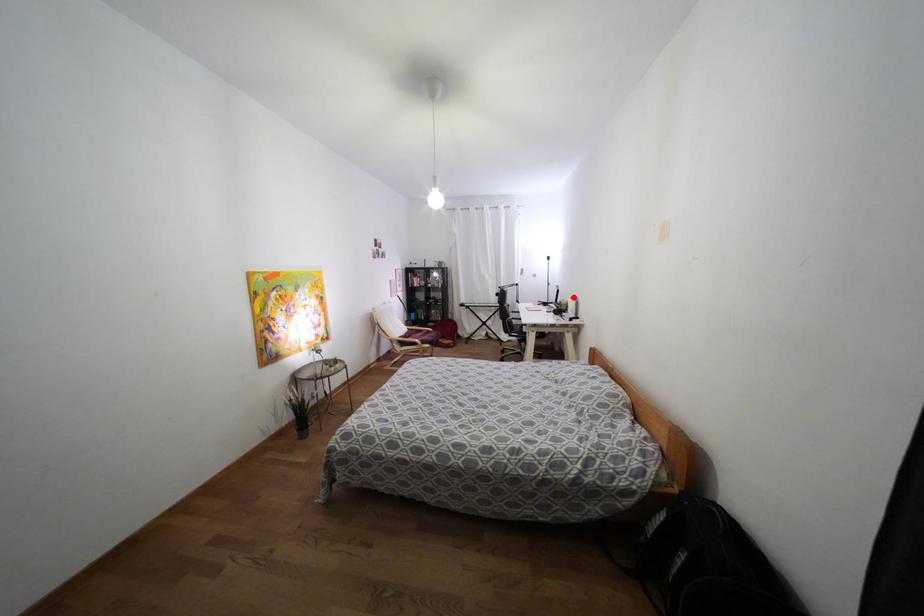
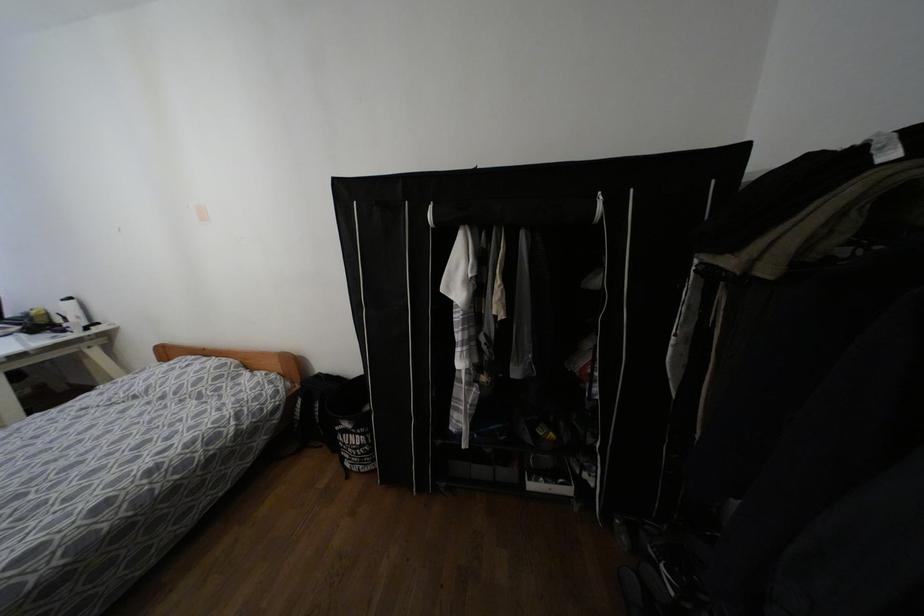
Question: I am providing you with two images of the same scene from different viewpoints. In image1, a red point is highlighted. Considering the same 3D point in image2, which of the following is correct?

Choices:
 (A) It is closer
 (B) It is farther

Answer: (B)